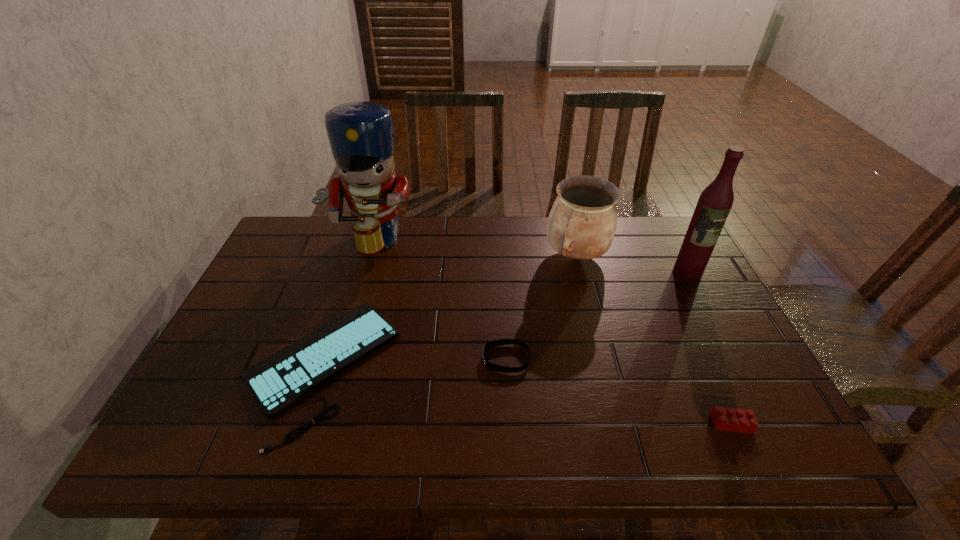
You are a GUI agent. You are given a task and a screenshot of the screen. Output one action in this format:
    pyautogui.click(x=<x>, y=<y>)
    Task: Click on the object that is the nearest to the Lego
    The image size is (960, 540).
    Given the screenshot: What is the action you would take?
    pyautogui.click(x=494, y=343)

Identify which object is located as the fourth nearest to the liquor. Please provide its 2D coordinates. Your answer should be formatted as a tuple, i.e. [(x, y)], where the tuple contains the x and y coordinates of a point satisfying the conditions above.

[(277, 381)]

What are the coordinates of `free location that satisfies the following two spatial constraints: 1. on the label of the liquor; 2. on the display of the fourth object from right to left` in the screenshot? It's located at (731, 359).

Identify the location of vacant region that satisfies the following two spatial constraints: 1. on the front-facing side of the third shortest object; 2. on the left side of the nutcracker. The width and height of the screenshot is (960, 540). (311, 423).

At what (x,y) coordinates should I click in order to perform the action: click on vacant point that satisfies the following two spatial constraints: 1. on the display of the fourth object from right to left; 2. on the back side of the third shortest object. Please return your answer as a coordinate pair (x, y). Looking at the image, I should click on (510, 423).

Locate an element on the screen. This screenshot has width=960, height=540. free space that satisfies the following two spatial constraints: 1. on the display of the fourth tallest object; 2. on the right side of the wristband is located at coordinates (510, 423).

Locate an element on the screen. The width and height of the screenshot is (960, 540). vacant area that satisfies the following two spatial constraints: 1. on the front side of the computer keyboard; 2. on the right side of the fourth tallest object is located at coordinates (300, 423).

Image resolution: width=960 pixels, height=540 pixels. I want to click on vacant area that satisfies the following two spatial constraints: 1. on the display of the Lego; 2. on the right side of the wristband, so click(510, 423).